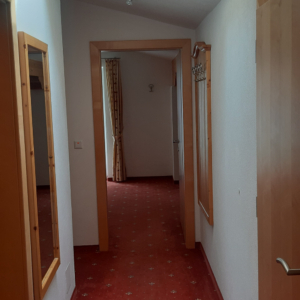
Find the location of a particular element. The width and height of the screenshot is (300, 300). handle is located at coordinates (288, 271).